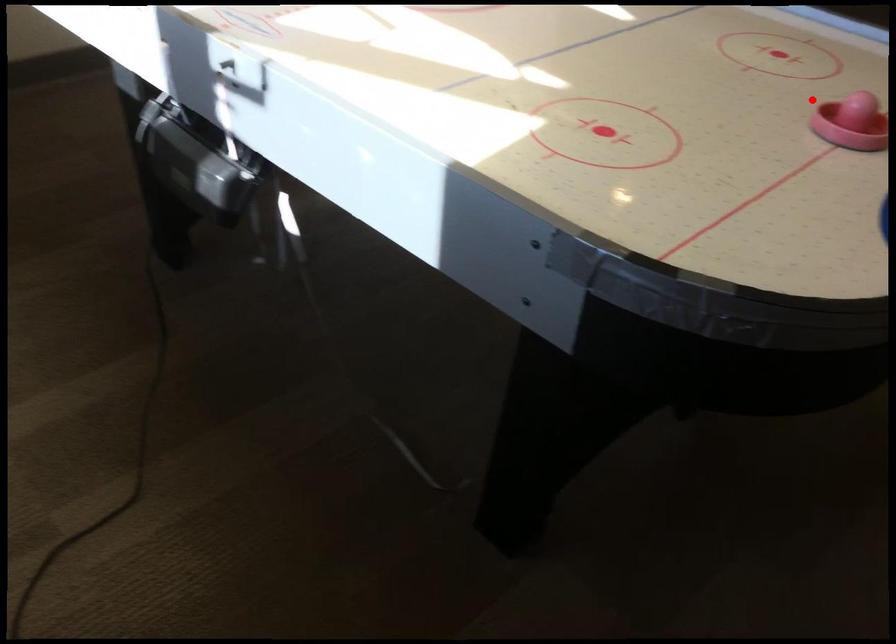
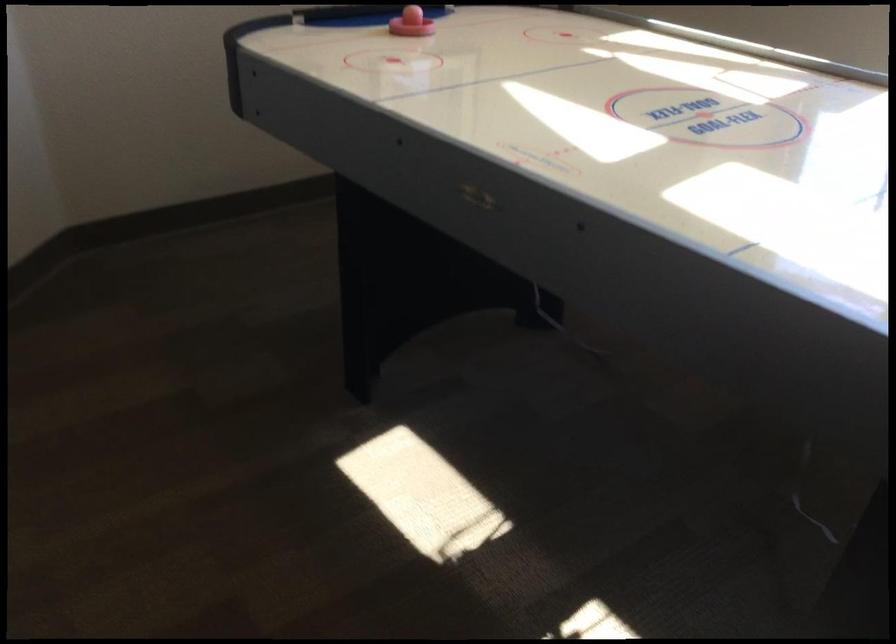
The point at the highlighted location is marked in the first image. Where is the corresponding point in the second image?

(410, 23)